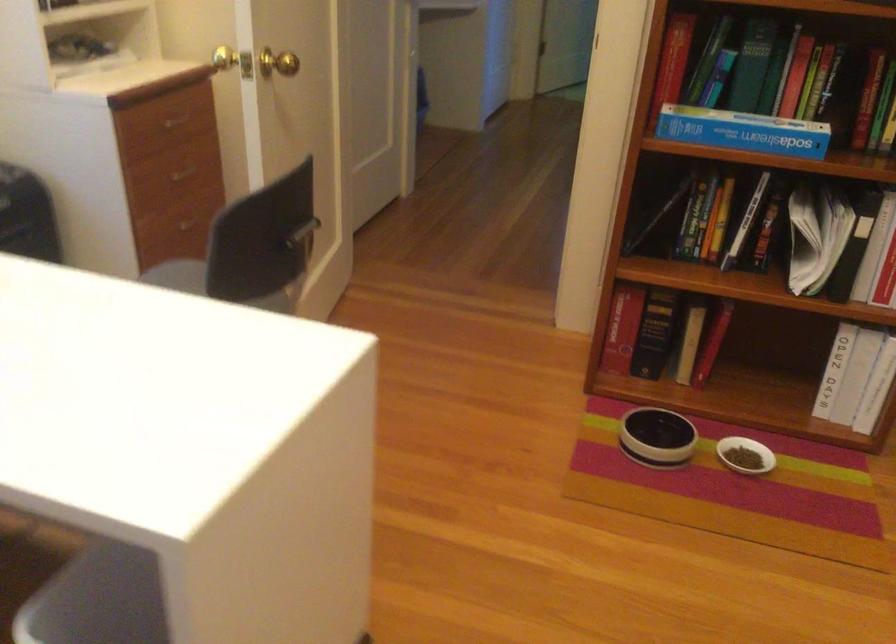
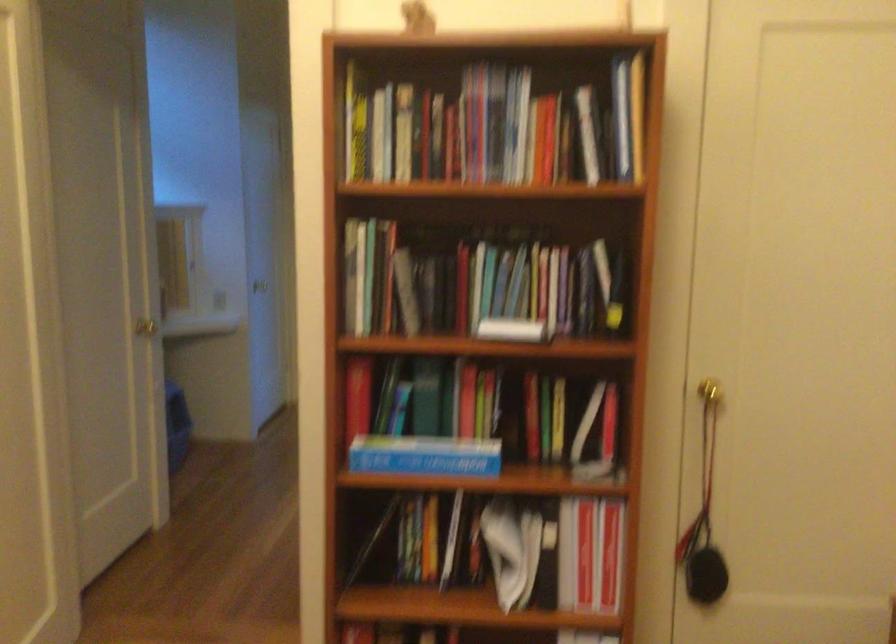
Question: The images are taken continuously from a first-person perspective. In which direction are you moving?

Choices:
 (A) Left
 (B) Right
 (C) Forward
 (D) Backward

Answer: (B)